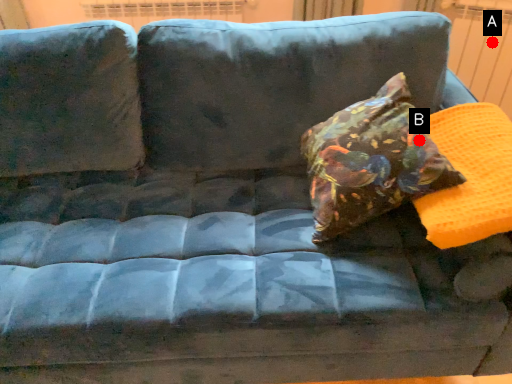
Question: Two points are circled on the image, labeled by A and B beside each circle. Which point is closer to the camera?

Choices:
 (A) A is closer
 (B) B is closer

Answer: (B)